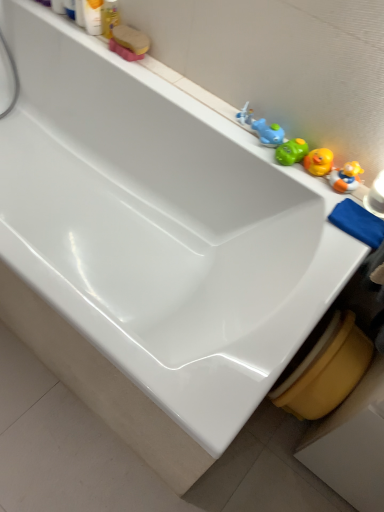
This screenshot has width=384, height=512. Identify the location of free location in front of blue cloth at right. (334, 260).